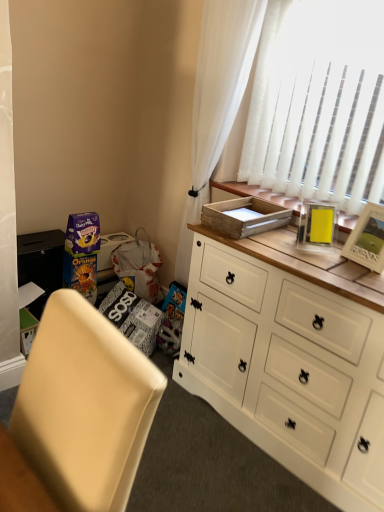
Question: Does beige fabric chair at lower left appear on the left side of white wood cabinet at center?

Choices:
 (A) no
 (B) yes

Answer: (B)

Question: From the image's perspective, would you say beige fabric chair at lower left is shown under white wood cabinet at center?

Choices:
 (A) no
 (B) yes

Answer: (B)

Question: Is beige fabric chair at lower left facing towards white wood cabinet at center?

Choices:
 (A) no
 (B) yes

Answer: (A)

Question: Is beige fabric chair at lower left at the right side of white wood cabinet at center?

Choices:
 (A) yes
 (B) no

Answer: (B)

Question: Is beige fabric chair at lower left smaller than white wood cabinet at center?

Choices:
 (A) no
 (B) yes

Answer: (B)

Question: From the image's perspective, is white wood cabinet at center positioned above or below beige fabric chair at lower left?

Choices:
 (A) above
 (B) below

Answer: (A)

Question: Is white wood cabinet at center situated inside beige fabric chair at lower left or outside?

Choices:
 (A) outside
 (B) inside

Answer: (A)

Question: Considering the positions of point (324, 307) and point (104, 342), is point (324, 307) closer or farther from the camera than point (104, 342)?

Choices:
 (A) closer
 (B) farther

Answer: (B)

Question: Based on their sizes in the image, would you say white wood cabinet at center is bigger or smaller than beige fabric chair at lower left?

Choices:
 (A) big
 (B) small

Answer: (A)

Question: From a real-world perspective, is wooden picture frame at upper right positioned above or below white wood cabinet at center?

Choices:
 (A) below
 (B) above

Answer: (B)

Question: From the image's perspective, is wooden picture frame at upper right located above or below white wood cabinet at center?

Choices:
 (A) below
 (B) above

Answer: (B)

Question: Considering their positions, is wooden picture frame at upper right located in front of or behind white wood cabinet at center?

Choices:
 (A) behind
 (B) front

Answer: (A)

Question: Looking at their shapes, would you say wooden picture frame at upper right is wider or thinner than white wood cabinet at center?

Choices:
 (A) wide
 (B) thin

Answer: (B)

Question: Choose the correct answer: Is matte cardboard box at lower left inside wooden tray at upper right or outside it?

Choices:
 (A) outside
 (B) inside

Answer: (A)

Question: Looking at the image, does matte cardboard box at lower left seem bigger or smaller compared to wooden tray at upper right?

Choices:
 (A) small
 (B) big

Answer: (B)